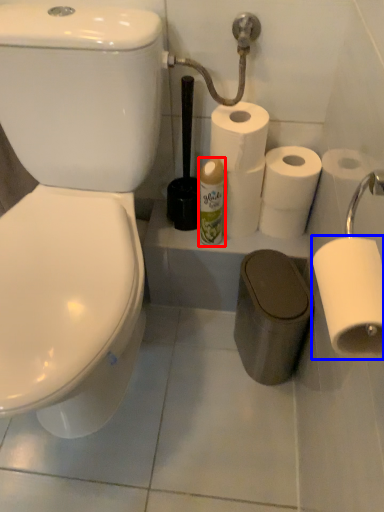
Question: Among these objects, which one is nearest to the camera, toiletry (highlighted by a red box) or toilet paper (highlighted by a blue box)?

Choices:
 (A) toiletry
 (B) toilet paper

Answer: (B)